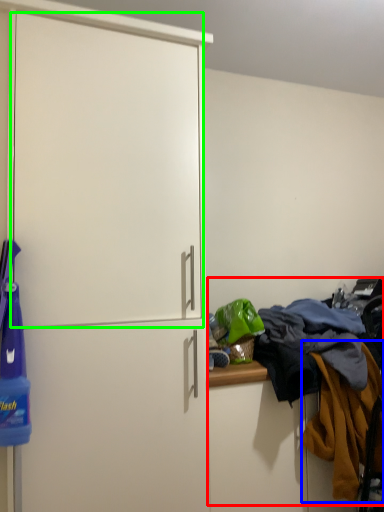
Question: Which is nearer to the laundry (highlighted by a red box)? clothing (highlighted by a blue box) or screen door (highlighted by a green box).

Choices:
 (A) clothing
 (B) screen door

Answer: (A)